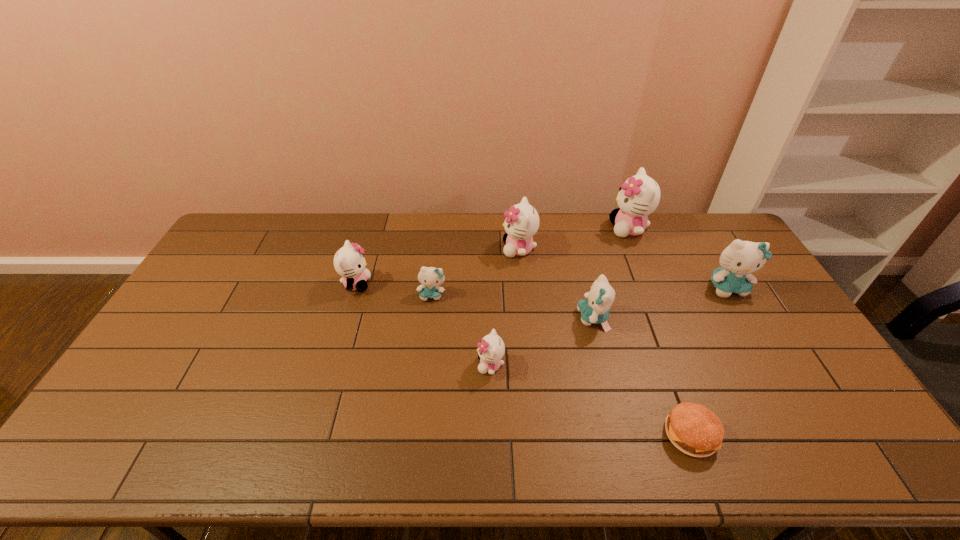
Image resolution: width=960 pixels, height=540 pixels. What are the coordinates of `object identified as the fifth closest to the hamburger` in the screenshot? It's located at (639, 196).

The width and height of the screenshot is (960, 540). I want to click on kitten that is the third closest to the nearest kitten, so click(522, 222).

Point out which kitten is positioned as the fifth nearest to the second biggest blue kitten. Please provide its 2D coordinates. Your answer should be formatted as a tuple, i.e. [(x, y)], where the tuple contains the x and y coordinates of a point satisfying the conditions above.

[(430, 277)]

Find the location of a particular element. The image size is (960, 540). the second closest white kitten relative to the biggest white kitten is located at coordinates (491, 349).

Point out which white kitten is positioned as the second nearest to the leftmost kitten. Please provide its 2D coordinates. Your answer should be formatted as a tuple, i.e. [(x, y)], where the tuple contains the x and y coordinates of a point satisfying the conditions above.

[(522, 222)]

At what (x,y) coordinates should I click in order to perform the action: click on blue kitten that is the second closest to the rightmost object. Please return your answer as a coordinate pair (x, y). Image resolution: width=960 pixels, height=540 pixels. Looking at the image, I should click on (430, 277).

Identify which blue kitten is the closest to the shortest object. Please provide its 2D coordinates. Your answer should be formatted as a tuple, i.e. [(x, y)], where the tuple contains the x and y coordinates of a point satisfying the conditions above.

[(595, 310)]

The height and width of the screenshot is (540, 960). I want to click on free spot that satisfies the following two spatial constraints: 1. on the front-facing side of the third white kitten from left to right; 2. on the left side of the shortest object, so click(538, 434).

I want to click on vacant position in the image that satisfies the following two spatial constraints: 1. on the face of the shortest object; 2. on the right side of the leftmost blue kitten, so click(x=417, y=434).

Image resolution: width=960 pixels, height=540 pixels. Identify the location of free spot that satisfies the following two spatial constraints: 1. on the face of the rightmost blue kitten; 2. on the front-facing side of the second white kitten from left to right. (773, 365).